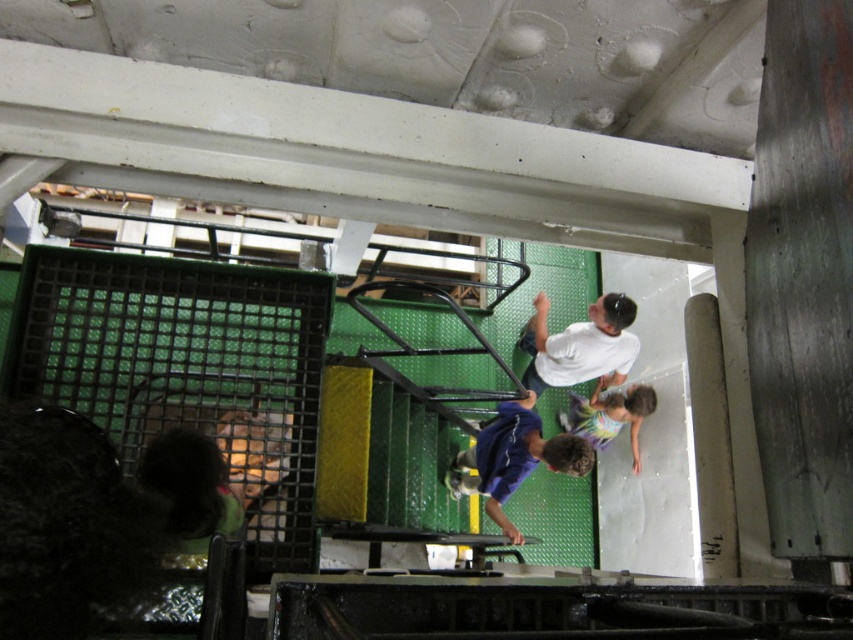
Based on the photo, you are a worker in this industrial area and need to move a tool from the blue matte skateboard at center to the white matte shirt at upper center. In which direction should you move the tool relative to the skateboard?

The blue matte skateboard at center is to the left of the white matte shirt at upper center, so you should move the tool to the right to reach the white matte shirt at upper center.

You are a delivery person who needs to place both the blue matte skateboard at center and the multicolored striped swimsuit at center into a storage locker. The locker has a maximum capacity of 1 meter in length. Can you fit both items inside without exceeding the length limit?

Result: The blue matte skateboard at center is bigger than the multicolored striped swimsuit at center. However, the exact dimensions are not provided. Therefore, it is uncertain whether both items can fit within the 1 meter length limit.

From the picture: You are a worker in this industrial area and need to retrieve an item. You see a blue matte skateboard at center and a white matte shirt at upper center. Which object is positioned lower in the scene?

The blue matte skateboard at center is located below the white matte shirt at upper center, so it is positioned lower in the scene.